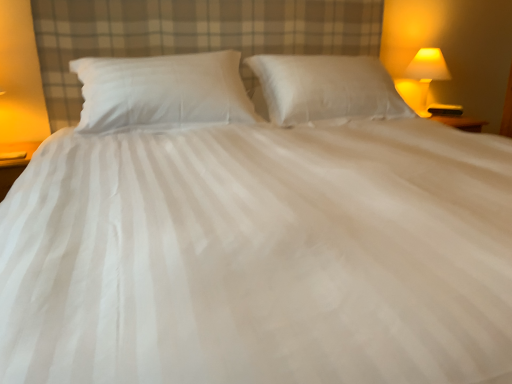
You are a GUI agent. You are given a task and a screenshot of the screen. Output one action in this format:
    pyautogui.click(x=<x>, y=<y>)
    Task: Click on the white cotton pillow at center, the 1th pillow when ordered from left to right
    This screenshot has width=512, height=384.
    Given the screenshot: What is the action you would take?
    pyautogui.click(x=162, y=91)

What do you see at coordinates (426, 70) in the screenshot? The width and height of the screenshot is (512, 384). I see `matte yellow glass lamp at upper right` at bounding box center [426, 70].

I want to click on white soft pillow at center, which appears as the second pillow when viewed from the left, so point(326,88).

Find the location of a particular element. This screenshot has width=512, height=384. white cotton pillow at center, the 2th pillow from the right is located at coordinates (162, 91).

Is white soft pillow at center, the 1th pillow in the right-to-left sequence, placed right next to matte yellow glass lamp at upper right?

No, white soft pillow at center, the 1th pillow in the right-to-left sequence, is not with matte yellow glass lamp at upper right.

From the image's perspective, which is above, white soft pillow at center, the 1th pillow in the right-to-left sequence, or matte yellow glass lamp at upper right?

matte yellow glass lamp at upper right, from the image's perspective.

Looking at this image, is white soft pillow at center, which appears as the second pillow when viewed from the left, completely or partially outside of matte yellow glass lamp at upper right?

Yes, white soft pillow at center, which appears as the second pillow when viewed from the left, is located beyond the bounds of matte yellow glass lamp at upper right.

Based on the photo, is white soft pillow at center, which appears as the second pillow when viewed from the left, wider or thinner than matte yellow glass lamp at upper right?

Considering their sizes, white soft pillow at center, which appears as the second pillow when viewed from the left, looks broader than matte yellow glass lamp at upper right.

Locate an element on the screen. This screenshot has width=512, height=384. pillow on the left side of white soft pillow at center, the 1th pillow in the right-to-left sequence is located at coordinates (162, 91).

Can you confirm if white cotton pillow at center, the 2th pillow from the right, is thinner than white soft pillow at center, the 1th pillow in the right-to-left sequence?

No, white cotton pillow at center, the 2th pillow from the right, is not thinner than white soft pillow at center, the 1th pillow in the right-to-left sequence.

Which is closer, (135, 103) or (291, 123)?

Clearly, point (135, 103) is closer to the camera than point (291, 123).

From a real-world perspective, does white cotton pillow at center, the 2th pillow from the right, sit lower than white soft pillow at center, the 1th pillow in the right-to-left sequence?

No, from a real-world perspective, white cotton pillow at center, the 2th pillow from the right, is not beneath white soft pillow at center, the 1th pillow in the right-to-left sequence.

From a real-world perspective, relative to white cotton pillow at center, the 1th pillow when ordered from left to right, is white soft pillow at center, which appears as the second pillow when viewed from the left, vertically above or below?

In terms of real-world spatial position, white soft pillow at center, which appears as the second pillow when viewed from the left, is below white cotton pillow at center, the 1th pillow when ordered from left to right.

Considering the positions of objects white soft pillow at center, the 1th pillow in the right-to-left sequence, and white cotton pillow at center, the 2th pillow from the right, in the image provided, who is behind, white soft pillow at center, the 1th pillow in the right-to-left sequence, or white cotton pillow at center, the 2th pillow from the right,?

white soft pillow at center, the 1th pillow in the right-to-left sequence.

Is white soft pillow at center, which appears as the second pillow when viewed from the left, turned away from white cotton pillow at center, the 2th pillow from the right?

That's not correct — white soft pillow at center, which appears as the second pillow when viewed from the left, is not looking away from white cotton pillow at center, the 2th pillow from the right.

How many degrees apart are the facing directions of white soft pillow at center, the 1th pillow in the right-to-left sequence, and white cotton pillow at center, the 2th pillow from the right?

There is a 0.00017-degree angle between the facing directions of white soft pillow at center, the 1th pillow in the right-to-left sequence, and white cotton pillow at center, the 2th pillow from the right.

From a real-world perspective, is white cotton pillow at center, the 2th pillow from the right, positioned above or below matte yellow glass lamp at upper right?

white cotton pillow at center, the 2th pillow from the right, is situated higher than matte yellow glass lamp at upper right in the real world.

How different are the orientations of white cotton pillow at center, the 1th pillow when ordered from left to right, and matte yellow glass lamp at upper right in degrees?

white cotton pillow at center, the 1th pillow when ordered from left to right, and matte yellow glass lamp at upper right are facing 0.000153 degrees away from each other.

Based on their sizes in the image, would you say white cotton pillow at center, the 1th pillow when ordered from left to right, is bigger or smaller than matte yellow glass lamp at upper right?

Considering their sizes, white cotton pillow at center, the 1th pillow when ordered from left to right, takes up more space than matte yellow glass lamp at upper right.

Between matte yellow glass lamp at upper right and white cotton pillow at center, the 2th pillow from the right, which one has larger size?

white cotton pillow at center, the 2th pillow from the right.

From the image's perspective, between matte yellow glass lamp at upper right and white cotton pillow at center, the 1th pillow when ordered from left to right, who is located below?

From the image's view, white cotton pillow at center, the 1th pillow when ordered from left to right, is below.

From a real-world perspective, which pillow is the 2nd one above the matte yellow glass lamp at upper right? Please provide its 2D coordinates.

[(162, 91)]

Is matte yellow glass lamp at upper right beside white cotton pillow at center, the 2th pillow from the right?

There is a gap between matte yellow glass lamp at upper right and white cotton pillow at center, the 2th pillow from the right.

Between matte yellow glass lamp at upper right and white soft pillow at center, which appears as the second pillow when viewed from the left, which one appears on the right side from the viewer's perspective?

From the viewer's perspective, matte yellow glass lamp at upper right appears more on the right side.

Considering their positions, is matte yellow glass lamp at upper right located in front of or behind white soft pillow at center, the 1th pillow in the right-to-left sequence?

Clearly, matte yellow glass lamp at upper right is behind white soft pillow at center, the 1th pillow in the right-to-left sequence.

Is matte yellow glass lamp at upper right located outside white soft pillow at center, which appears as the second pillow when viewed from the left?

Yes.

Does matte yellow glass lamp at upper right have a lesser height compared to white soft pillow at center, the 1th pillow in the right-to-left sequence?

In fact, matte yellow glass lamp at upper right may be taller than white soft pillow at center, the 1th pillow in the right-to-left sequence.

Where is `the 1st pillow in front of the matte yellow glass lamp at upper right`? the 1st pillow in front of the matte yellow glass lamp at upper right is located at coordinates (326, 88).

Identify the location of pillow behind the white cotton pillow at center, the 2th pillow from the right. The height and width of the screenshot is (384, 512). (326, 88).

Estimate the real-world distances between objects in this image. Which object is closer to matte yellow glass lamp at upper right, white soft pillow at center, which appears as the second pillow when viewed from the left, or white cotton pillow at center, the 2th pillow from the right?

Based on the image, white soft pillow at center, which appears as the second pillow when viewed from the left, appears to be nearer to matte yellow glass lamp at upper right.

When comparing their distances from white cotton pillow at center, the 2th pillow from the right, does matte yellow glass lamp at upper right or white soft pillow at center, which appears as the second pillow when viewed from the left, seem further?

Based on the image, matte yellow glass lamp at upper right appears to be further to white cotton pillow at center, the 2th pillow from the right.

From the image, which object appears to be nearer to white cotton pillow at center, the 2th pillow from the right, white soft pillow at center, the 1th pillow in the right-to-left sequence, or matte yellow glass lamp at upper right?

white soft pillow at center, the 1th pillow in the right-to-left sequence, is closer to white cotton pillow at center, the 2th pillow from the right.

Based on the photo, based on their spatial positions, is white cotton pillow at center, the 2th pillow from the right, or white soft pillow at center, which appears as the second pillow when viewed from the left, closer to matte yellow glass lamp at upper right?

Among the two, white soft pillow at center, which appears as the second pillow when viewed from the left, is located nearer to matte yellow glass lamp at upper right.

Looking at this image, considering their positions, is matte yellow glass lamp at upper right positioned closer to white soft pillow at center, which appears as the second pillow when viewed from the left, than white cotton pillow at center, the 2th pillow from the right?

The object closer to white soft pillow at center, which appears as the second pillow when viewed from the left, is white cotton pillow at center, the 2th pillow from the right.

From the picture: When comparing their distances from white soft pillow at center, the 1th pillow in the right-to-left sequence, does white cotton pillow at center, the 1th pillow when ordered from left to right, or matte yellow glass lamp at upper right seem further?

matte yellow glass lamp at upper right is positioned further to the anchor white soft pillow at center, the 1th pillow in the right-to-left sequence.

Find the location of a particular element. pillow situated between white cotton pillow at center, the 1th pillow when ordered from left to right, and matte yellow glass lamp at upper right from left to right is located at coordinates (326, 88).